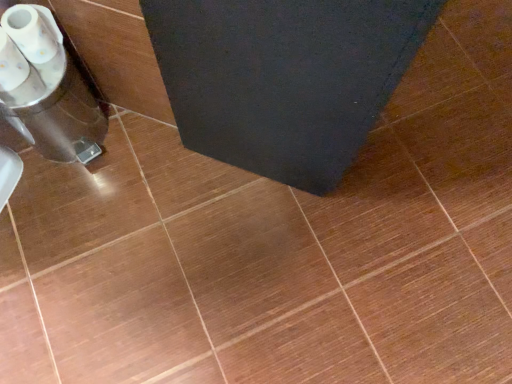
Measure the distance between translucent plastic cups at left and camera.

translucent plastic cups at left and camera are 32.19 inches apart.

What do you see at coordinates (47, 88) in the screenshot? The width and height of the screenshot is (512, 384). I see `translucent plastic cups at left` at bounding box center [47, 88].

I want to click on translucent plastic cups at left, so click(x=47, y=88).

In order to face translucent plastic cups at left, should I rotate leftwards or rightwards?

To face it directly, rotate left by 25.449 degrees.

What do you see at coordinates (32, 32) in the screenshot? The image size is (512, 384). I see `white glossy toilet paper at lower left` at bounding box center [32, 32].

Locate an element on the screen. white glossy toilet paper at lower left is located at coordinates (32, 32).

What is the approximate width of white glossy toilet paper at lower left?

white glossy toilet paper at lower left is 3.48 inches wide.

Measure the distance between point [17,11] and camera.

32.17 inches.

What is the approximate height of white glossy toilet paper at lower left?

5.03 inches.

What are the coordinates of `translucent plastic cups at left` in the screenshot? It's located at (47, 88).

Is white glossy toilet paper at lower left at the right side of translucent plastic cups at left?

Yes, white glossy toilet paper at lower left is to the right of translucent plastic cups at left.

Does white glossy toilet paper at lower left come in front of translucent plastic cups at left?

That is True.

Is point (39, 17) closer or farther from the camera than point (51, 93)?

Clearly, point (39, 17) is closer to the camera than point (51, 93).

In the scene shown: From the image's perspective, relative to translucent plastic cups at left, is white glossy toilet paper at lower left above or below?

white glossy toilet paper at lower left is situated higher than translucent plastic cups at left in the image.

From a real-world perspective, is white glossy toilet paper at lower left positioned above or below translucent plastic cups at left?

In terms of real-world spatial position, white glossy toilet paper at lower left is above translucent plastic cups at left.

Based on the photo, which object is thinner, white glossy toilet paper at lower left or translucent plastic cups at left?

white glossy toilet paper at lower left.

Is white glossy toilet paper at lower left taller or shorter than translucent plastic cups at left?

Considering their sizes, white glossy toilet paper at lower left has less height than translucent plastic cups at left.

Does white glossy toilet paper at lower left have a larger size compared to translucent plastic cups at left?

Actually, white glossy toilet paper at lower left might be smaller than translucent plastic cups at left.

Would you say white glossy toilet paper at lower left is outside translucent plastic cups at left?

Yes, white glossy toilet paper at lower left is located beyond the bounds of translucent plastic cups at left.

Would you consider white glossy toilet paper at lower left to be distant from translucent plastic cups at left?

That's not correct — white glossy toilet paper at lower left is a little close to translucent plastic cups at left.

Could you tell me if white glossy toilet paper at lower left is facing translucent plastic cups at left?

No.

From the picture: How different are the orientations of white glossy toilet paper at lower left and translucent plastic cups at left in degrees?

0.000173 degrees.

How distant is white glossy toilet paper at lower left from translucent plastic cups at left?

They are 14.13 centimeters apart.

There is a translucent plastic cups at left. Where is `toilet paper above it (from a real-world perspective)`? toilet paper above it (from a real-world perspective) is located at coordinates (32, 32).

Is translucent plastic cups at left to the left of white glossy toilet paper at lower left from the viewer's perspective?

Yes, translucent plastic cups at left is to the left of white glossy toilet paper at lower left.

Is the position of translucent plastic cups at left more distant than that of white glossy toilet paper at lower left?

Yes.

Which is closer to the camera, (x=31, y=57) or (x=18, y=43)?

Point (x=31, y=57) is positioned farther from the camera compared to point (x=18, y=43).

In the scene shown: From the image's perspective, which one is positioned lower, translucent plastic cups at left or white glossy toilet paper at lower left?

translucent plastic cups at left.

From a real-world perspective, is translucent plastic cups at left physically below white glossy toilet paper at lower left?

Yes, from a real-world perspective, translucent plastic cups at left is below white glossy toilet paper at lower left.

Is translucent plastic cups at left wider or thinner than white glossy toilet paper at lower left?

Clearly, translucent plastic cups at left has more width compared to white glossy toilet paper at lower left.

Considering the sizes of translucent plastic cups at left and white glossy toilet paper at lower left in the image, is translucent plastic cups at left taller or shorter than white glossy toilet paper at lower left?

translucent plastic cups at left is taller than white glossy toilet paper at lower left.

Is translucent plastic cups at left bigger or smaller than white glossy toilet paper at lower left?

Considering their sizes, translucent plastic cups at left takes up more space than white glossy toilet paper at lower left.

Is translucent plastic cups at left positioned beyond the bounds of white glossy toilet paper at lower left?

translucent plastic cups at left lies outside white glossy toilet paper at lower left's area.

Are translucent plastic cups at left and white glossy toilet paper at lower left beside each other?

There is a gap between translucent plastic cups at left and white glossy toilet paper at lower left.

Based on the photo, could you tell me if translucent plastic cups at left is turned towards white glossy toilet paper at lower left?

No, translucent plastic cups at left is not aimed at white glossy toilet paper at lower left.

How different are the orientations of translucent plastic cups at left and white glossy toilet paper at lower left in degrees?

They differ by 0.000173 degrees in their facing directions.

This screenshot has width=512, height=384. Find the location of `toilet paper located above the translucent plastic cups at left (from the image's perspective)`. toilet paper located above the translucent plastic cups at left (from the image's perspective) is located at coordinates (32, 32).

Where is `appliance behind the white glossy toilet paper at lower left`? This screenshot has width=512, height=384. appliance behind the white glossy toilet paper at lower left is located at coordinates (47, 88).

Where is `appliance located below the white glossy toilet paper at lower left (from the image's perspective)`? The width and height of the screenshot is (512, 384). appliance located below the white glossy toilet paper at lower left (from the image's perspective) is located at coordinates (47, 88).